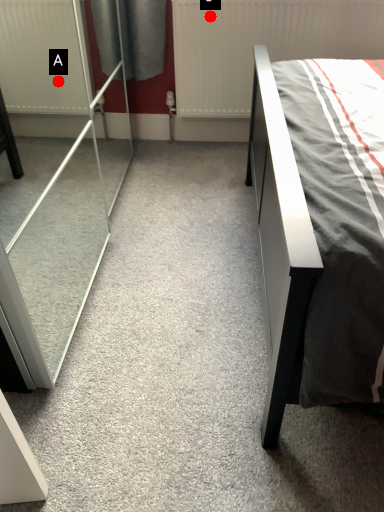
Question: Two points are circled on the image, labeled by A and B beside each circle. Among these points, which one is nearest to the camera?

Choices:
 (A) A is closer
 (B) B is closer

Answer: (B)